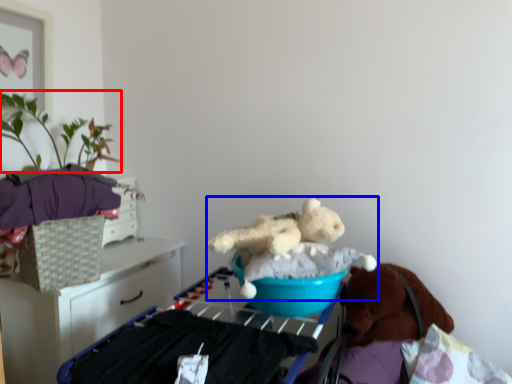
Question: Among these objects, which one is farthest to the camera, plant (highlighted by a red box) or teddy bear (highlighted by a blue box)?

Choices:
 (A) plant
 (B) teddy bear

Answer: (A)